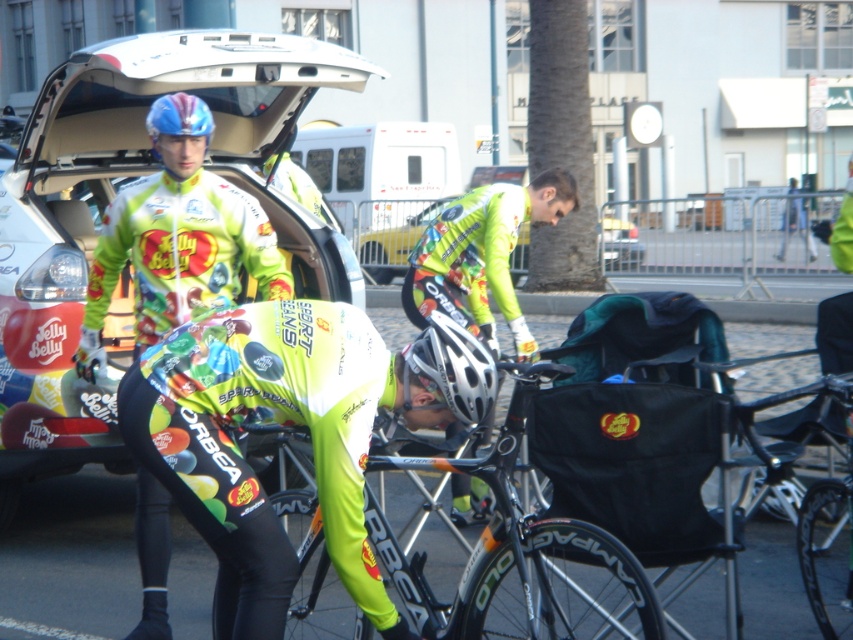
Is matte white car at center taller than neon green jersey at center?

Yes, matte white car at center is taller than neon green jersey at center.

Is matte white car at center to the left of neon green jersey at center from the viewer's perspective?

Correct, you'll find matte white car at center to the left of neon green jersey at center.

Measure the distance between point [79,170] and camera.

They are 29.95 feet apart.

This screenshot has width=853, height=640. I want to click on matte white car at center, so click(109, 198).

Based on the photo, can you confirm if shiny metallic bicycle at center is positioned above shiny blue helmet at upper left?

No, shiny metallic bicycle at center is not above shiny blue helmet at upper left.

Does shiny metallic bicycle at center lie behind shiny blue helmet at upper left?

No.

The height and width of the screenshot is (640, 853). Describe the element at coordinates (520, 560) in the screenshot. I see `shiny metallic bicycle at center` at that location.

Where is `shiny metallic bicycle at center`? This screenshot has height=640, width=853. shiny metallic bicycle at center is located at coordinates (520, 560).

Is neon green jersey at center in front of shiny blue helmet at upper left?

Yes.

In the scene shown: Can you confirm if neon green jersey at center is positioned above shiny blue helmet at upper left?

No, neon green jersey at center is not above shiny blue helmet at upper left.

What do you see at coordinates (289, 424) in the screenshot? The width and height of the screenshot is (853, 640). I see `neon green jersey at center` at bounding box center [289, 424].

At what (x,y) coordinates should I click in order to perform the action: click on neon green jersey at center. Please return your answer as a coordinate pair (x, y). Looking at the image, I should click on (289, 424).